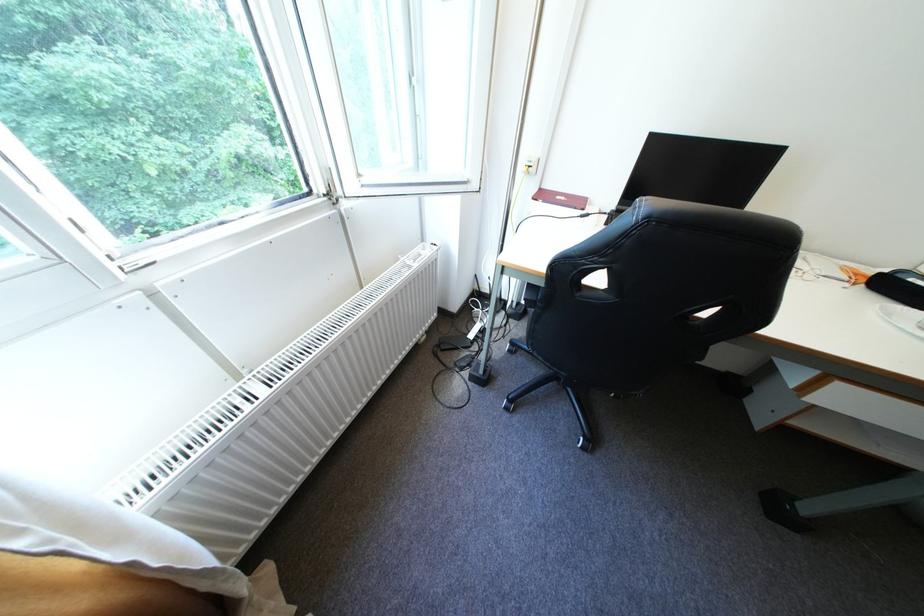
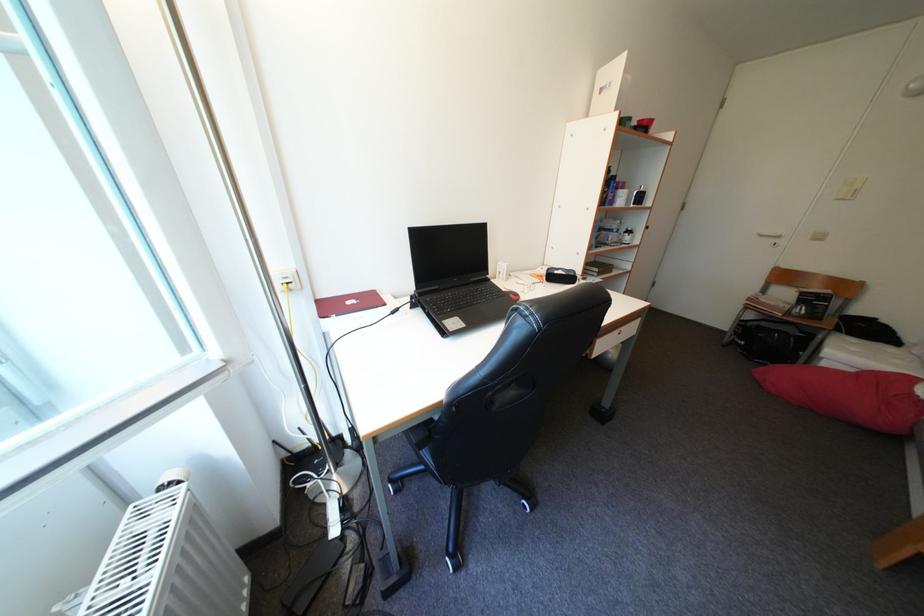
Question: The camera is either moving clockwise (left) or counter-clockwise (right) around the object. The first image is from the beginning of the video and the second image is from the end. Is the camera moving left or right when shooting the video?

Choices:
 (A) Left
 (B) Right

Answer: (A)